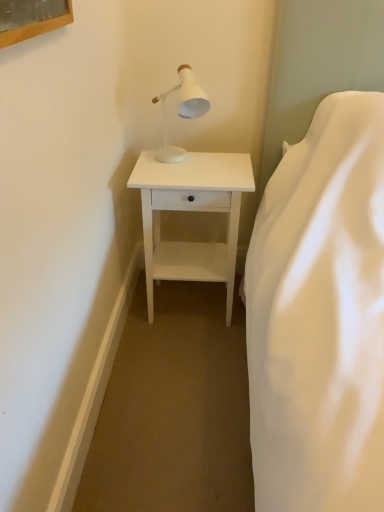
What do you see at coordinates (191, 210) in the screenshot? I see `white matte nightstand at lower center` at bounding box center [191, 210].

The image size is (384, 512). I want to click on white matte nightstand at lower center, so click(191, 210).

What is the approximate height of white matte table lamp at upper center?

white matte table lamp at upper center is 35.55 centimeters in height.

What do you see at coordinates (182, 111) in the screenshot? I see `white matte table lamp at upper center` at bounding box center [182, 111].

Identify the location of white matte table lamp at upper center. This screenshot has width=384, height=512. (182, 111).

This screenshot has height=512, width=384. I want to click on white matte nightstand at lower center, so click(191, 210).

Is white matte nightstand at lower center to the left or to the right of white matte table lamp at upper center in the image?

In the image, white matte nightstand at lower center appears on the right side of white matte table lamp at upper center.

Is white matte nightstand at lower center behind white matte table lamp at upper center?

Yes, it is behind white matte table lamp at upper center.

Which point is more distant from viewer, (180, 268) or (174, 87)?

The point (180, 268) is farther from the camera.

From the image's perspective, is white matte nightstand at lower center above or below white matte table lamp at upper center?

Based on their image positions, white matte nightstand at lower center is located beneath white matte table lamp at upper center.

From a real-world perspective, who is located lower, white matte nightstand at lower center or white matte table lamp at upper center?

In real-world perspective, white matte nightstand at lower center is lower.

Considering the relative sizes of white matte nightstand at lower center and white matte table lamp at upper center in the image provided, is white matte nightstand at lower center wider than white matte table lamp at upper center?

Yes.

Is white matte nightstand at lower center taller or shorter than white matte table lamp at upper center?

white matte nightstand at lower center is taller than white matte table lamp at upper center.

Is white matte nightstand at lower center bigger or smaller than white matte table lamp at upper center?

white matte nightstand at lower center is bigger than white matte table lamp at upper center.

Consider the image. Is white matte nightstand at lower center inside the boundaries of white matte table lamp at upper center, or outside?

white matte nightstand at lower center is outside white matte table lamp at upper center.

Can you see white matte nightstand at lower center touching white matte table lamp at upper center?

No, white matte nightstand at lower center is not making contact with white matte table lamp at upper center.

Is white matte nightstand at lower center facing towards white matte table lamp at upper center?

No, white matte nightstand at lower center is not turned towards white matte table lamp at upper center.

How different are the orientations of white matte nightstand at lower center and white matte table lamp at upper center in degrees?

There is a 0.000635-degree angle between the facing directions of white matte nightstand at lower center and white matte table lamp at upper center.

This screenshot has width=384, height=512. Find the location of `nightstand that is below the white matte table lamp at upper center (from the image's perspective)`. nightstand that is below the white matte table lamp at upper center (from the image's perspective) is located at coordinates (191, 210).

Considering the relative positions of white matte table lamp at upper center and white matte nightstand at lower center in the image provided, is white matte table lamp at upper center to the left or to the right of white matte nightstand at lower center?

In the image, white matte table lamp at upper center appears on the left side of white matte nightstand at lower center.

Is white matte table lamp at upper center positioned behind white matte nightstand at lower center?

No.

Considering the points (202, 106) and (238, 207), which point is behind, point (202, 106) or point (238, 207)?

The point (238, 207) is farther from the camera.

From the picture: From the image's perspective, between white matte table lamp at upper center and white matte nightstand at lower center, which one is located above?

white matte table lamp at upper center appears higher in the image.

From a real-world perspective, which is physically above, white matte table lamp at upper center or white matte nightstand at lower center?

white matte table lamp at upper center.

Which of these two, white matte table lamp at upper center or white matte nightstand at lower center, is wider?

white matte nightstand at lower center.

Looking at this image, between white matte table lamp at upper center and white matte nightstand at lower center, which one has less height?

white matte table lamp at upper center.

Who is smaller, white matte table lamp at upper center or white matte nightstand at lower center?

white matte table lamp at upper center is smaller.

Is white matte nightstand at lower center surrounded by white matte table lamp at upper center?

No.

Is the surface of white matte table lamp at upper center in direct contact with white matte nightstand at lower center?

No, white matte table lamp at upper center is not beside white matte nightstand at lower center.

Is white matte table lamp at upper center facing towards white matte nightstand at lower center?

No, white matte table lamp at upper center is not turned towards white matte nightstand at lower center.

How many degrees apart are the facing directions of white matte table lamp at upper center and white matte nightstand at lower center?

0.000635 degrees separate the facing orientations of white matte table lamp at upper center and white matte nightstand at lower center.

Where is `table lamp located on the left of white matte nightstand at lower center`? The width and height of the screenshot is (384, 512). table lamp located on the left of white matte nightstand at lower center is located at coordinates (182, 111).

Where is `nightstand behind the white matte table lamp at upper center`? Image resolution: width=384 pixels, height=512 pixels. nightstand behind the white matte table lamp at upper center is located at coordinates (191, 210).

Image resolution: width=384 pixels, height=512 pixels. What are the coordinates of `table lamp above the white matte nightstand at lower center (from the image's perspective)` in the screenshot? It's located at (182, 111).